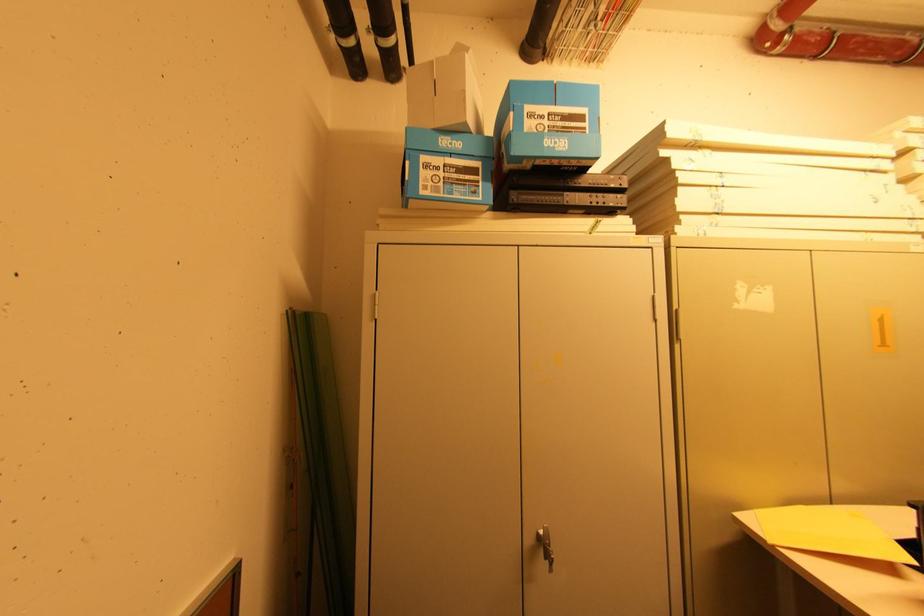
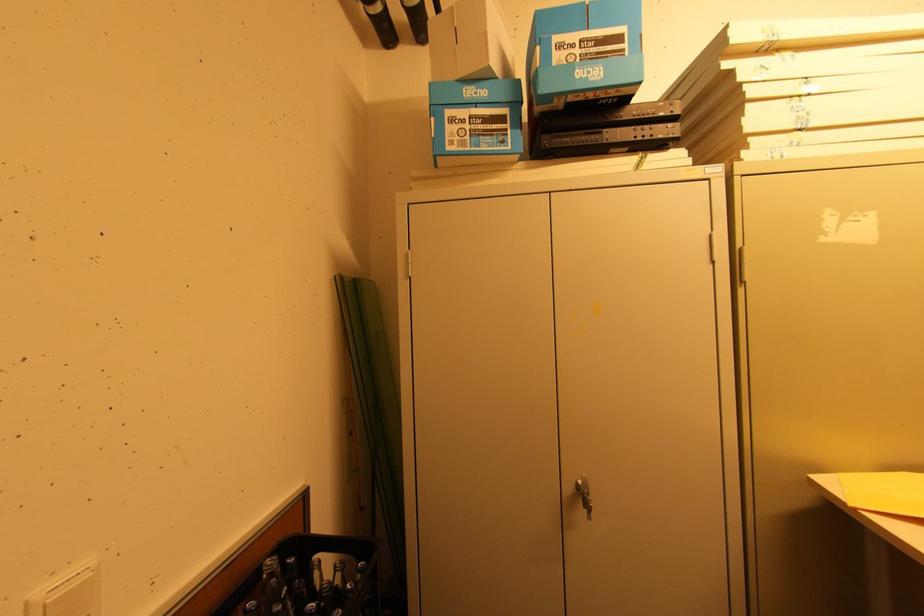
Question: The first image is from the beginning of the video and the second image is from the end. How did the camera likely rotate when shooting the video?

Choices:
 (A) Left
 (B) Right
 (C) Up
 (D) Down

Answer: (A)